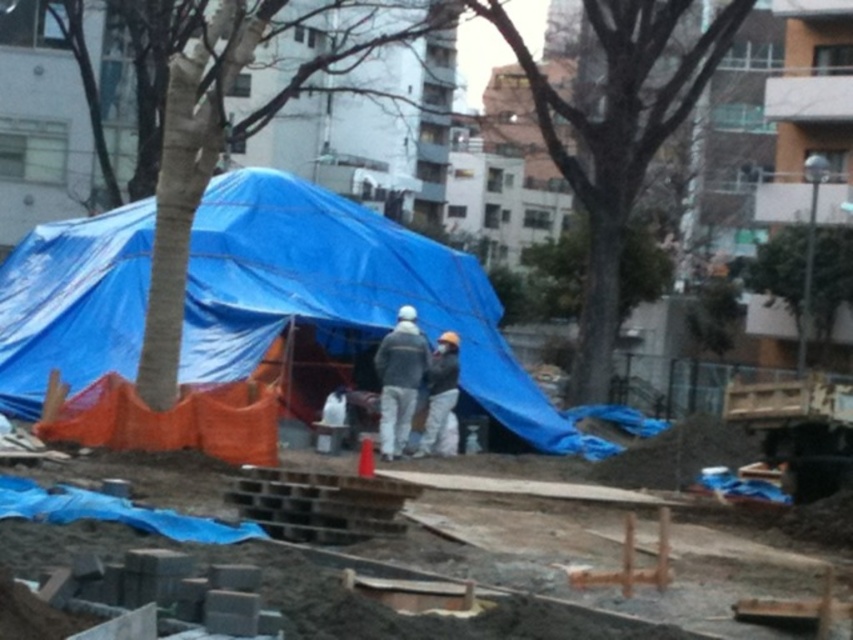
Consider the image. Is smooth bark tree at center wider than gray fabric worker at center?

Indeed, smooth bark tree at center has a greater width compared to gray fabric worker at center.

From the picture: Does smooth bark tree at center have a larger size compared to gray fabric worker at center?

Yes.

Who is more forward, [590,90] or [453,342]?

Point [453,342] is in front.

At what (x,y) coordinates should I click in order to perform the action: click on smooth bark tree at center. Please return your answer as a coordinate pair (x, y). Looking at the image, I should click on (616, 134).

Is gray fabric jacket at center below gray fabric worker at center?

Incorrect, gray fabric jacket at center is not positioned below gray fabric worker at center.

Is point (381, 422) closer to viewer compared to point (433, 426)?

Yes, point (381, 422) is in front of point (433, 426).

Is point (416, 365) in front of point (434, 426)?

Yes, it is.

Identify the location of gray fabric jacket at center. This screenshot has width=853, height=640. (399, 380).

Is blue tarpaulin tent at center thinner than gray fabric jacket at center?

No, blue tarpaulin tent at center is not thinner than gray fabric jacket at center.

Does blue tarpaulin tent at center have a smaller size compared to gray fabric jacket at center?

No.

Is point (196, 236) farther from viewer compared to point (398, 429)?

Yes, point (196, 236) is behind point (398, 429).

The height and width of the screenshot is (640, 853). I want to click on blue tarpaulin tent at center, so click(344, 294).